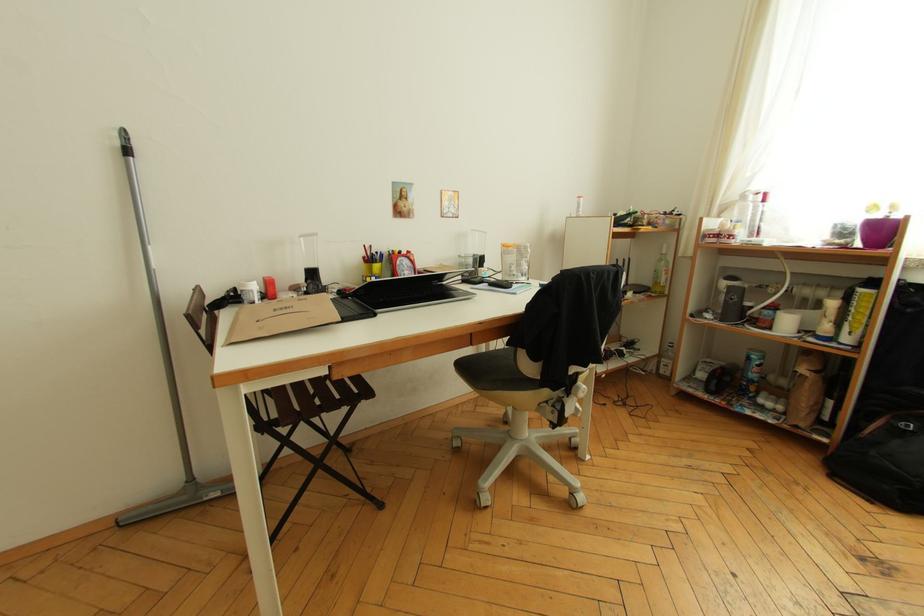
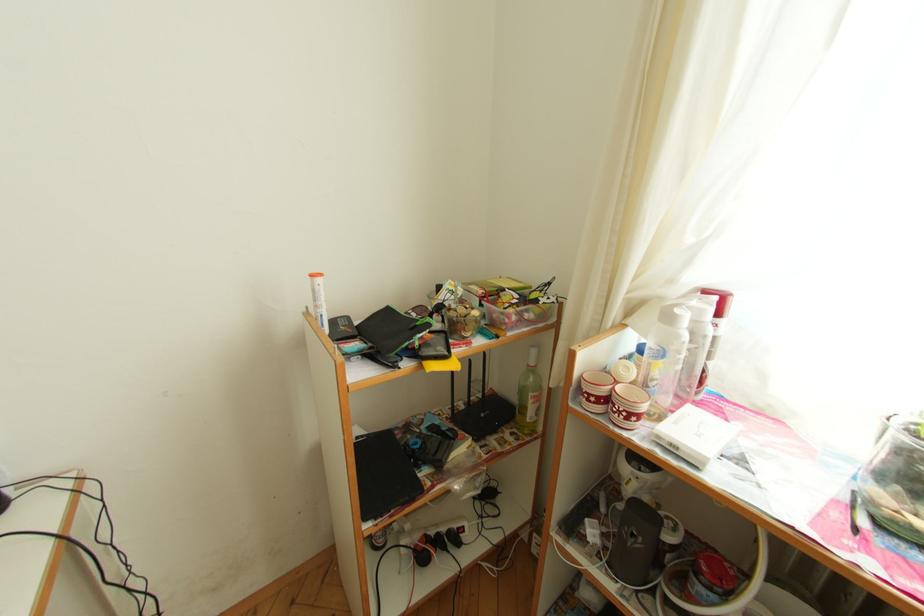
What movement of the cameraman would produce the second image?

The cameraman walked toward right, forward.